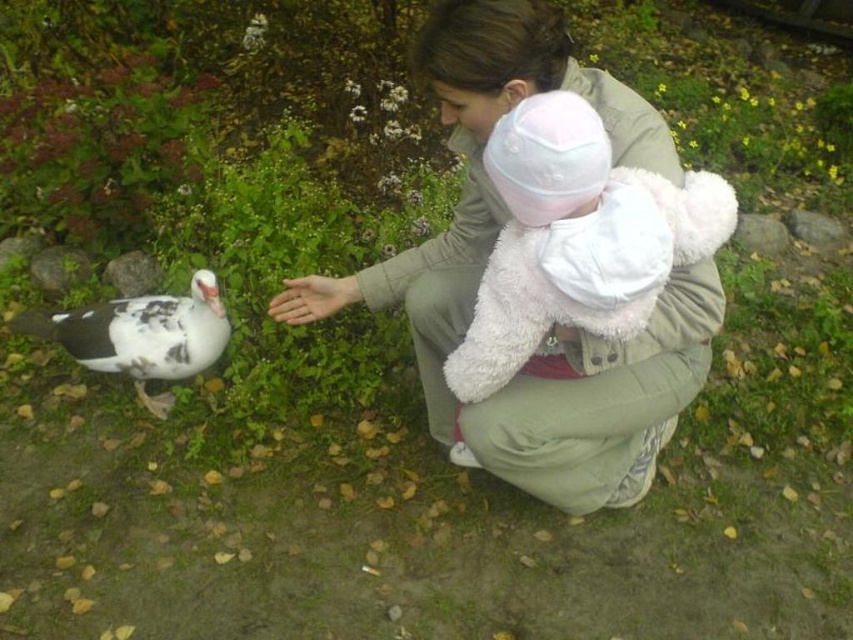
Question: Where is white plush hat at upper center located in relation to white speckled feather at lower left in the image?

Choices:
 (A) right
 (B) left

Answer: (A)

Question: Which point appears closest to the camera in this image?

Choices:
 (A) (640, 209)
 (B) (471, 301)
 (C) (190, 323)

Answer: (A)

Question: Which point is closer to the camera?

Choices:
 (A) white speckled feather at lower left
 (B) light beige fleece jacket at center

Answer: (B)

Question: Where is light beige fleece jacket at center located in relation to white plush hat at upper center in the image?

Choices:
 (A) left
 (B) right

Answer: (A)

Question: Which point appears closest to the camera in this image?

Choices:
 (A) (195, 278)
 (B) (701, 230)
 (C) (376, 280)

Answer: (B)

Question: Considering the relative positions of white plush hat at upper center and white speckled feather at lower left in the image provided, where is white plush hat at upper center located with respect to white speckled feather at lower left?

Choices:
 (A) left
 (B) right

Answer: (B)